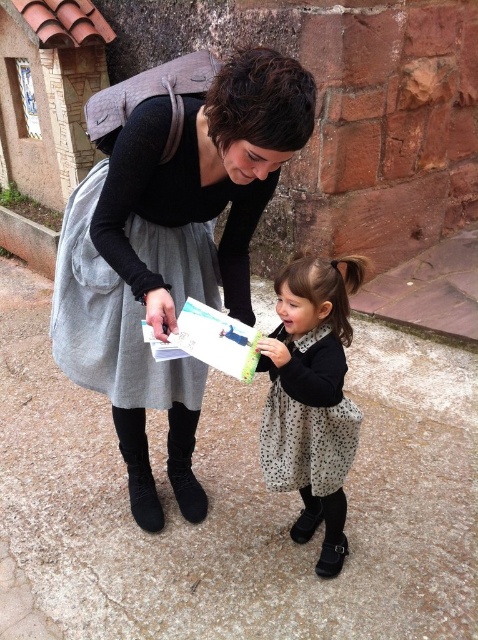
Question: Among these points, which one is farthest from the camera?

Choices:
 (A) (249, 56)
 (B) (282, 467)
 (C) (197, 486)

Answer: (C)

Question: Which point is closer to the camera taking this photo?

Choices:
 (A) (276, 304)
 (B) (136, 227)
 (C) (130, 468)
 (D) (271, 413)

Answer: (B)

Question: In this image, where is matte black dress at center located relative to polka dot dress at center?

Choices:
 (A) below
 (B) above

Answer: (B)

Question: Observing the image, what is the correct spatial positioning of matte black dress at center in reference to black suede boot at lower left?

Choices:
 (A) below
 (B) above

Answer: (B)

Question: Which point appears farthest from the camera in this image?

Choices:
 (A) (194, 432)
 (B) (358, 410)
 (C) (152, 492)

Answer: (C)

Question: Considering the relative positions of matte black dress at center and polka dot fabric dress at lower center in the image provided, where is matte black dress at center located with respect to polka dot fabric dress at lower center?

Choices:
 (A) right
 (B) left

Answer: (B)